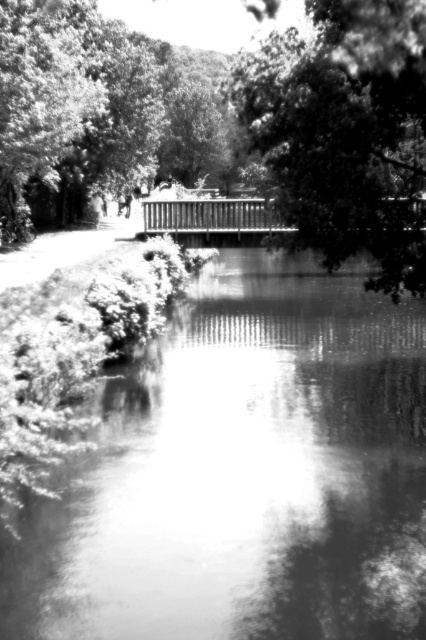
You are a photographer trying to capture the entire scene in one shot. Given that your camera can only focus on one object at a time, which object between the smooth water at center and the smooth green leafy tree at center should you choose to ensure the wider subject is in focus?

The smooth water at center has a larger width than the smooth green leafy tree at center, so you should focus on the smooth water at center to capture the wider subject in focus.

You are standing at the center of the paved path and want to walk towards both points marked in the image. Which point, point (x=268, y=432) or point (x=293, y=161), will you reach first?

Point (x=268, y=432) is closer to you than point (x=293, y=161), so you will reach point (x=268, y=432) first.

You are standing at the point marked by the coordinates point (244, 474) in the image. Based on the scene description, what would you most likely see around you?

The point (244, 474) marks smooth water at center, so you would most likely see the calm body of water reflecting the surrounding trees and sky around you.